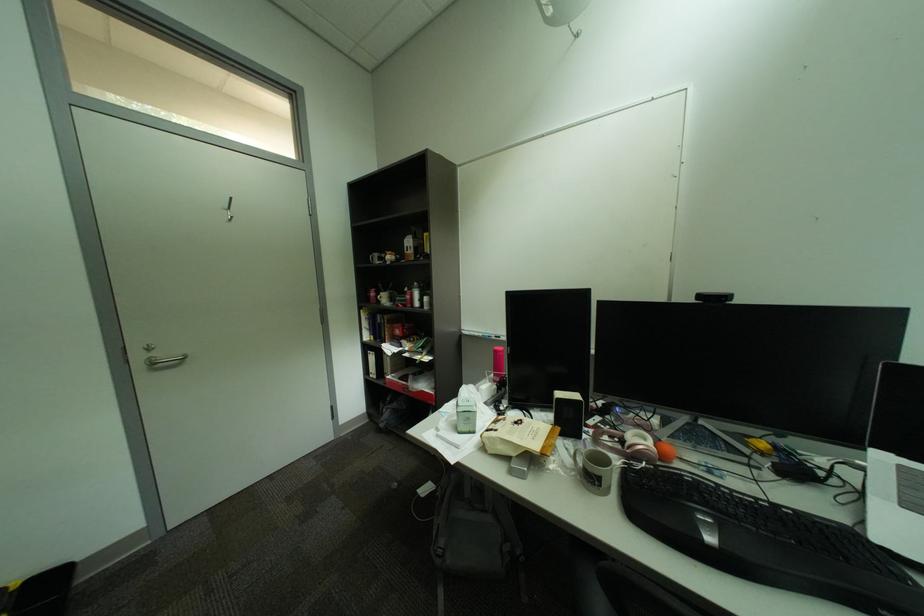
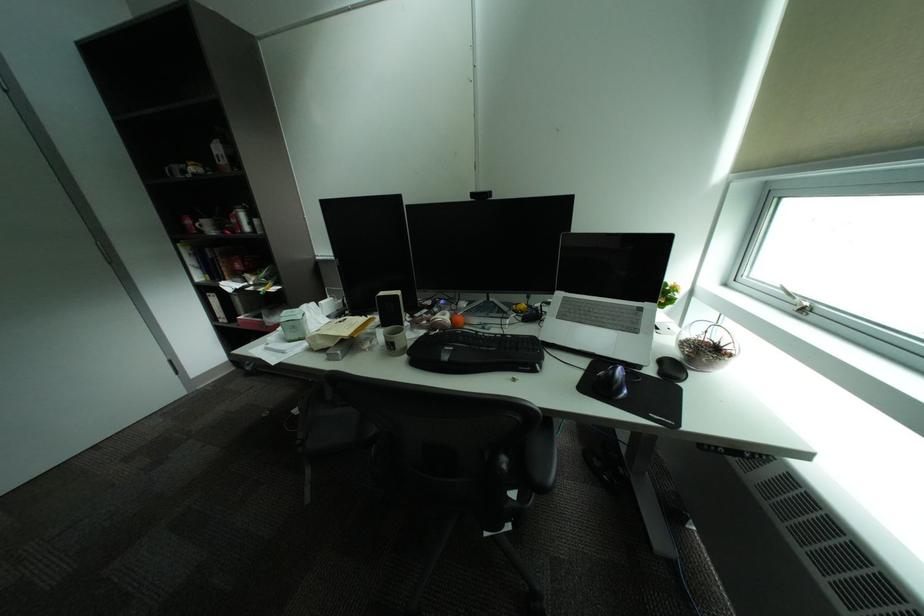
The point at (787, 507) is marked in the first image. Where is the corresponding point in the second image?

(516, 336)